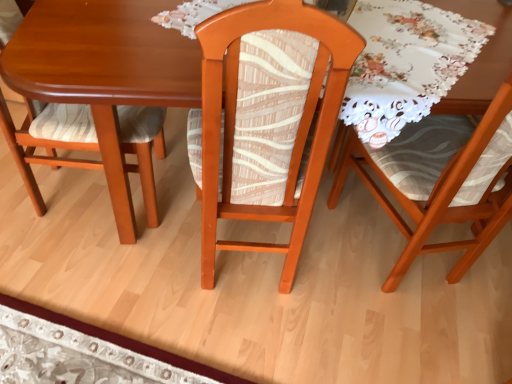
Where is `free spot in front of wooden chair at center, which appears as the second chair when viewed from the right`? This screenshot has width=512, height=384. free spot in front of wooden chair at center, which appears as the second chair when viewed from the right is located at coordinates (227, 332).